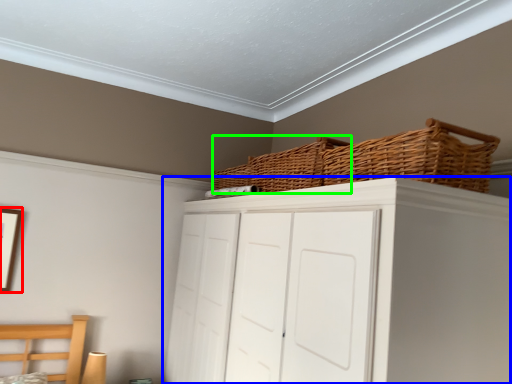
Question: Based on their relative distances, which object is farther from picture frame (highlighted by a red box)? Choose from cupboard (highlighted by a blue box) and basket (highlighted by a green box).

Choices:
 (A) cupboard
 (B) basket

Answer: (A)